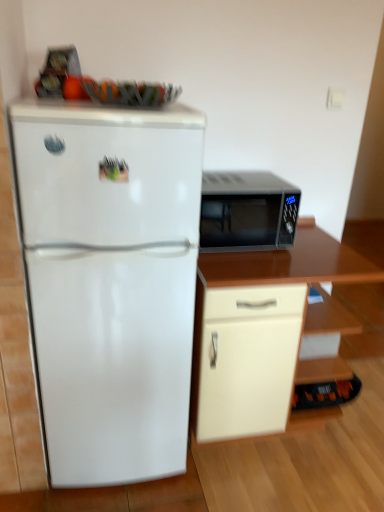
Question: From their relative heights in the image, would you say white glossy refrigerator at left is taller or shorter than beige matte cabinet at lower right?

Choices:
 (A) tall
 (B) short

Answer: (A)

Question: Does point (150, 399) appear closer or farther from the camera than point (208, 333)?

Choices:
 (A) farther
 (B) closer

Answer: (A)

Question: Estimate the real-world distances between objects in this image. Which object is closer to the white glossy refrigerator at left?

Choices:
 (A) matte black microwave at right
 (B) beige matte cabinet at lower right

Answer: (B)

Question: Which object is the farthest from the white glossy refrigerator at left?

Choices:
 (A) matte black microwave at right
 (B) beige matte cabinet at lower right

Answer: (A)